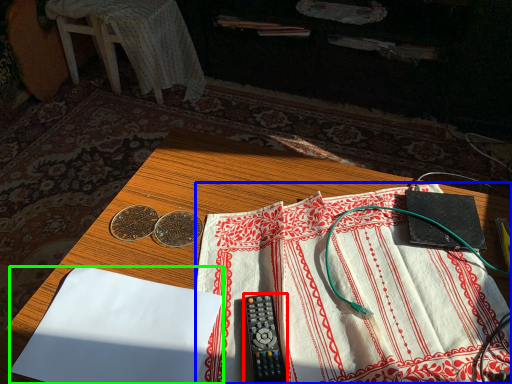
Question: Estimate the real-world distances between objects in this image. Which object is farther from stationery (highlighted by a red box), sheet (highlighted by a blue box) or sheet (highlighted by a green box)?

Choices:
 (A) sheet
 (B) sheet

Answer: (B)